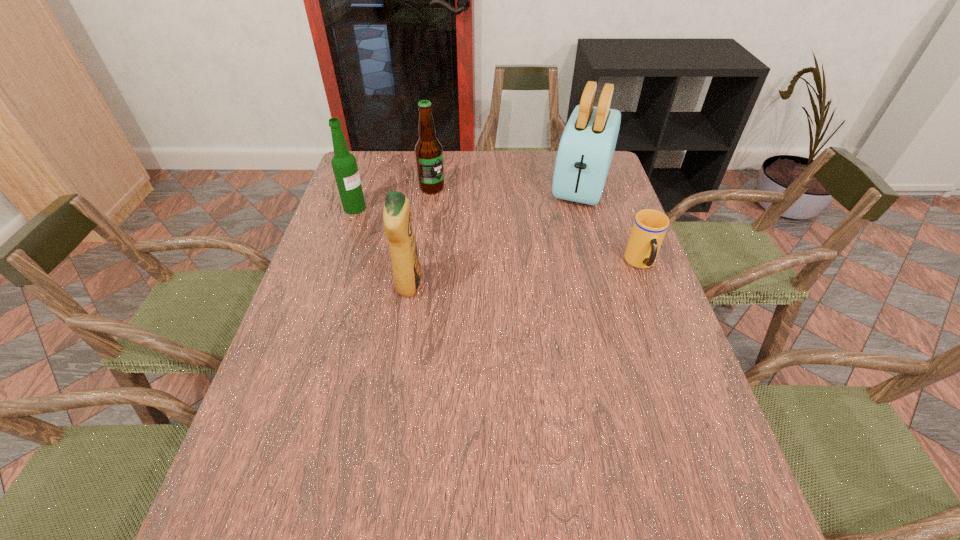
Locate an element on the screen. The height and width of the screenshot is (540, 960). blank region between the detergent and the farther beer bottle is located at coordinates (420, 237).

The width and height of the screenshot is (960, 540). I want to click on blank region between the right beer bottle and the detergent, so click(420, 237).

The width and height of the screenshot is (960, 540). What are the coordinates of `free space between the toaster and the farther beer bottle` in the screenshot? It's located at (507, 185).

Find the location of a particular element. This screenshot has height=540, width=960. free space between the right beer bottle and the toaster is located at coordinates (507, 185).

Where is `free space between the cup and the left beer bottle`? This screenshot has width=960, height=540. free space between the cup and the left beer bottle is located at coordinates (498, 235).

Identify the location of unoccupied position between the farther beer bottle and the shortest object. Image resolution: width=960 pixels, height=540 pixels. (537, 226).

This screenshot has height=540, width=960. I want to click on free space between the toaster and the leftmost object, so click(x=468, y=195).

Locate an element on the screen. vacant point located between the shortest object and the toaster is located at coordinates (612, 223).

I want to click on object that ranks as the fourth closest to the detergent, so [649, 228].

Choose which object is the third nearest neighbor to the leftmost object. Please provide its 2D coordinates. Your answer should be formatted as a tuple, i.e. [(x, y)], where the tuple contains the x and y coordinates of a point satisfying the conditions above.

[(587, 145)]